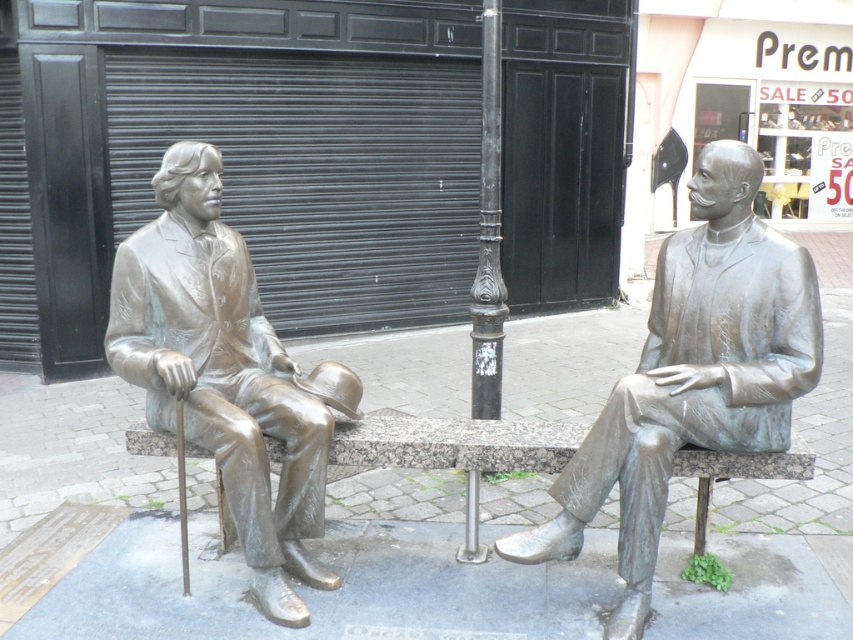
Who is more distant from viewer, (758, 380) or (498, 83)?

Positioned behind is point (498, 83).

Does point (762, 406) lie behind point (496, 330)?

No.

Identify the location of bronze statue at right. This screenshot has width=853, height=640. (692, 374).

This screenshot has height=640, width=853. I want to click on bronze statue at right, so click(x=692, y=374).

Can you confirm if bronze statue at left is thinner than black cast iron pole at center?

No.

Describe the element at coordinates (225, 372) in the screenshot. I see `bronze statue at left` at that location.

Who is more forward, (x=115, y=349) or (x=491, y=212)?

Point (x=115, y=349) is more forward.

Where is `bronze statue at left`? This screenshot has height=640, width=853. bronze statue at left is located at coordinates (225, 372).

Is the position of bronze statue at right less distant than that of bronze stone bench at center?

Yes, bronze statue at right is in front of bronze stone bench at center.

How far apart are bronze statue at right and bronze stone bench at center?

bronze statue at right and bronze stone bench at center are 21.84 inches apart from each other.

Locate an element on the screen. The height and width of the screenshot is (640, 853). bronze statue at right is located at coordinates (692, 374).